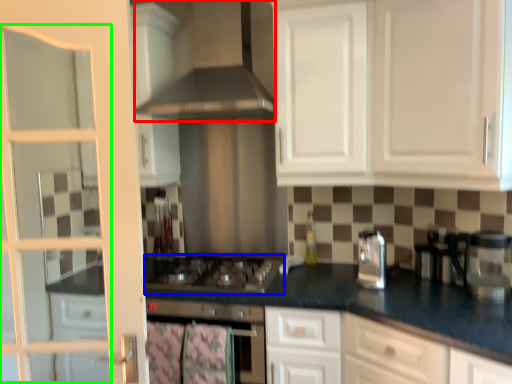
Question: Which is farther away from exhaust hood (highlighted by a red box)? gas stove (highlighted by a blue box) or screen door (highlighted by a green box)?

Choices:
 (A) gas stove
 (B) screen door

Answer: (A)